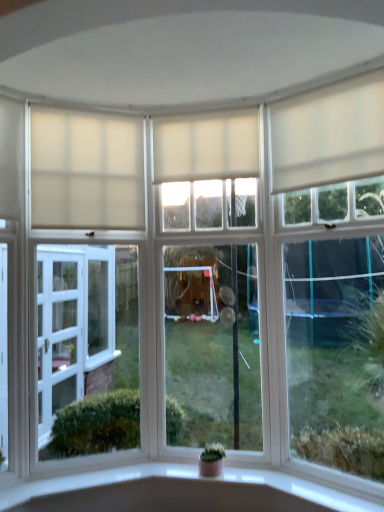
Where is `free spot above white matte curtain at upper right, the 1th curtain positioned from the right (from a real-world perspective)`? The image size is (384, 512). free spot above white matte curtain at upper right, the 1th curtain positioned from the right (from a real-world perspective) is located at coordinates (321, 82).